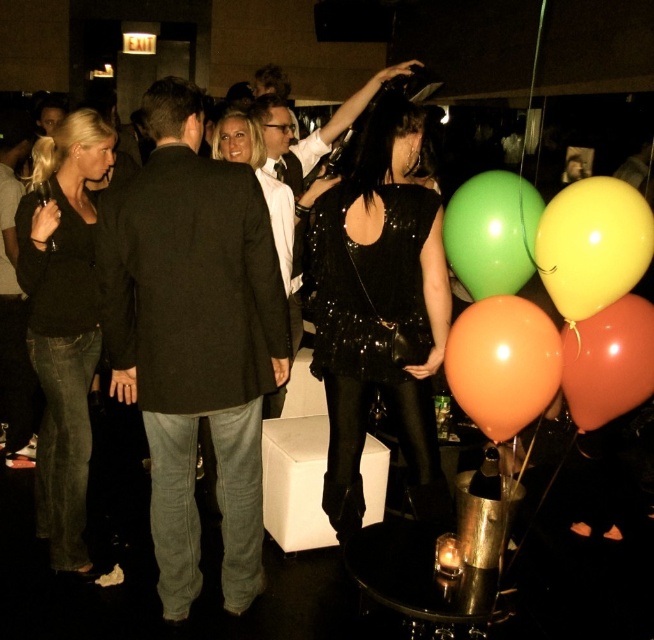
Question: Does black denim jeans at lower left appear on the left side of orange matte balloon at lower right?

Choices:
 (A) yes
 (B) no

Answer: (A)

Question: Based on their relative distances, which object is farther from the black sequined dress at center?

Choices:
 (A) orange matte balloon at lower right
 (B) matte black blazer at center
 (C) yellow matte balloon at upper right

Answer: (C)

Question: Which point is closer to the camera?

Choices:
 (A) orange matte balloon at lower right
 (B) black denim jeans at lower left
 (C) yellow matte balloon at upper right
 (D) green glossy balloon at center

Answer: (C)

Question: Does black wool suit at center appear under orange matte balloon at lower right?

Choices:
 (A) no
 (B) yes

Answer: (B)

Question: Can you confirm if green glossy balloon at center is positioned to the left of rubberized orange balloon at lower right?

Choices:
 (A) no
 (B) yes

Answer: (B)

Question: Which of the following is the closest to the observer?

Choices:
 (A) matte black blazer at center
 (B) yellow matte balloon at upper right
 (C) rubberized orange balloon at lower right
 (D) black sequined dress at center

Answer: (B)